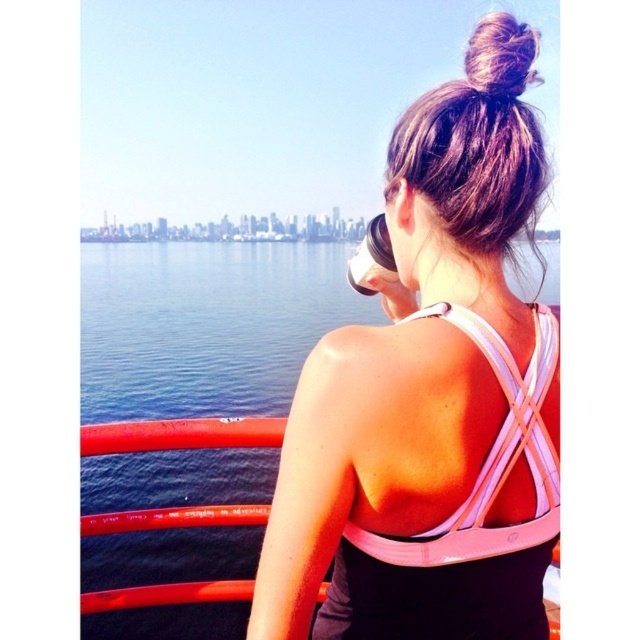
Consider the image. Can you confirm if blue water at center is positioned below brown silky hair bun at upper center?

No, blue water at center is not below brown silky hair bun at upper center.

Is point (147, 333) less distant than point (528, 61)?

No, it is not.

I want to click on blue water at center, so click(x=189, y=420).

Who is taller, pink fabric sports bra at upper center or blue water at center?

With more height is blue water at center.

The width and height of the screenshot is (640, 640). What do you see at coordinates (428, 410) in the screenshot?
I see `pink fabric sports bra at upper center` at bounding box center [428, 410].

You are a GUI agent. You are given a task and a screenshot of the screen. Output one action in this format:
    pyautogui.click(x=<x>, y=<y>)
    Task: Click on the pink fabric sports bra at upper center
    The image size is (640, 640).
    Given the screenshot: What is the action you would take?
    pyautogui.click(x=428, y=410)

Does pink fabric sports bra at upper center appear on the left side of brown silky hair bun at upper center?

Correct, you'll find pink fabric sports bra at upper center to the left of brown silky hair bun at upper center.

This screenshot has width=640, height=640. Find the location of `pink fabric sports bra at upper center`. pink fabric sports bra at upper center is located at coordinates (x=428, y=410).